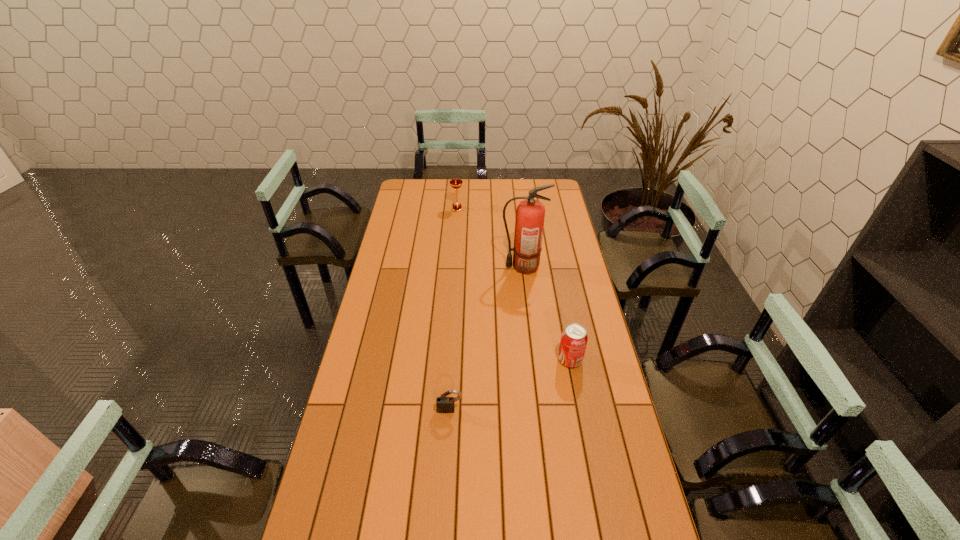
Identify the location of free space located 0.330m on the left of the third farthest object. This screenshot has height=540, width=960. (464, 360).

The width and height of the screenshot is (960, 540). Identify the location of vacant point located 0.230m with the keyhole on the front of the nearest object. (x=445, y=487).

You are a GUI agent. You are given a task and a screenshot of the screen. Output one action in this format:
    pyautogui.click(x=<x>, y=<y>)
    Task: Click on the fire extinguisher at the right edge
    The image size is (960, 540).
    Given the screenshot: What is the action you would take?
    pyautogui.click(x=529, y=222)

This screenshot has width=960, height=540. I want to click on soda that is at the right edge, so click(x=574, y=337).

I want to click on vacant position at the far edge of the desktop, so click(518, 194).

Find the location of a particular element. This screenshot has width=960, height=540. vacant space at the left edge is located at coordinates (x=381, y=374).

The height and width of the screenshot is (540, 960). I want to click on vacant space at the right edge of the desktop, so click(x=587, y=291).

Find the location of a particular element. This screenshot has height=540, width=960. vacant space at the far left corner of the desktop is located at coordinates (409, 180).

Find the location of a particular element. This screenshot has height=540, width=960. free region at the far right corner is located at coordinates (562, 195).

You are a GUI agent. You are given a task and a screenshot of the screen. Output one action in this format:
    pyautogui.click(x=<x>, y=<y>)
    Task: Click on the vacant space that is in between the nearest object and the third nearest object
    
    Given the screenshot: What is the action you would take?
    pos(487,338)